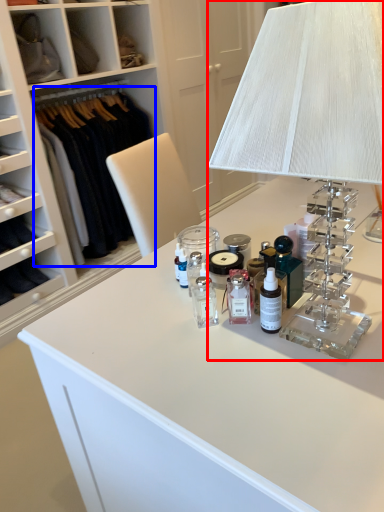
Question: Which point is closer to the camera, table lamp (highlighted by a red box) or clothing (highlighted by a blue box)?

Choices:
 (A) table lamp
 (B) clothing

Answer: (A)